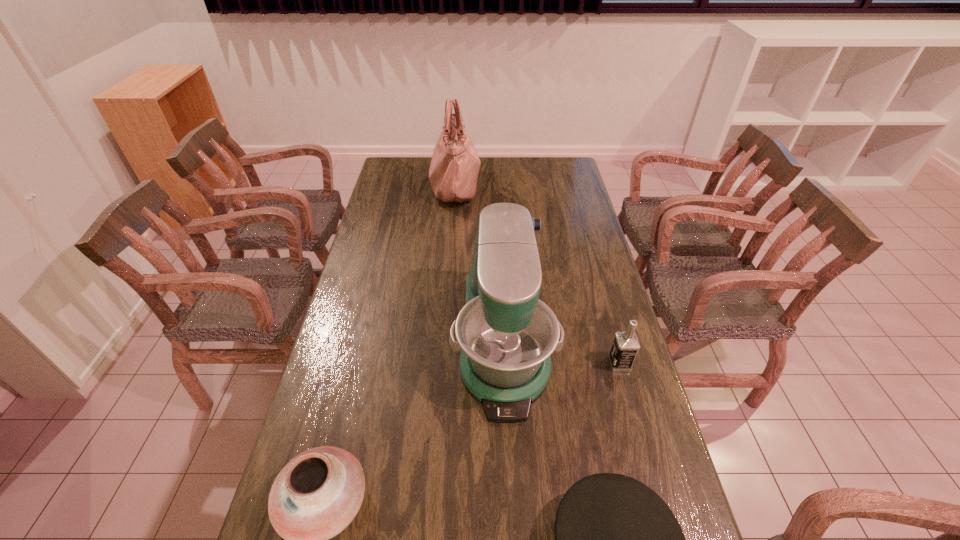
I want to click on the farthest object, so click(453, 173).

Where is `mixer`? The image size is (960, 540). mixer is located at coordinates (506, 334).

At what (x,y) coordinates should I click in order to perform the action: click on vodka. Please return your answer as a coordinate pair (x, y). The height and width of the screenshot is (540, 960). Looking at the image, I should click on (626, 345).

At what (x,y) coordinates should I click in order to perform the action: click on vacant point located 0.380m at the front of the farthest object with handles. Please return your answer as a coordinate pair (x, y). Image resolution: width=960 pixels, height=540 pixels. Looking at the image, I should click on (563, 186).

Where is `vacant space located on the front-facing side of the mixer`? vacant space located on the front-facing side of the mixer is located at coordinates (509, 445).

At what (x,y) coordinates should I click in order to perform the action: click on blank area located 0.250m on the front label of the vodka. Please return your answer as a coordinate pair (x, y). Looking at the image, I should click on (525, 363).

You are a GUI agent. You are given a task and a screenshot of the screen. Output one action in this format:
    pyautogui.click(x=<x>, y=<y>)
    Task: Click on the free space located on the front label of the vodka
    The image size is (960, 540).
    Given the screenshot: What is the action you would take?
    pyautogui.click(x=512, y=363)

This screenshot has width=960, height=540. In order to click on vacant space positioned 0.070m on the front label of the vodka in this screenshot , I will do `click(586, 363)`.

Locate an element on the screen. The image size is (960, 540). object situated at the far edge is located at coordinates (453, 173).

I want to click on object at the right edge, so click(x=626, y=345).